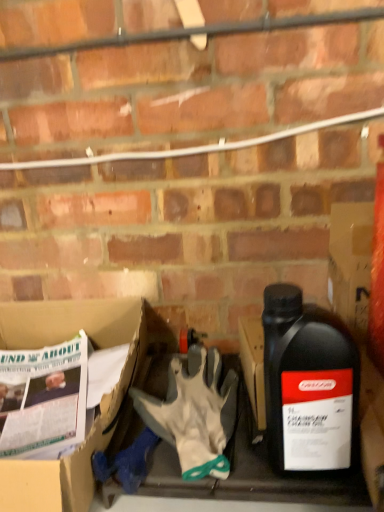
The height and width of the screenshot is (512, 384). I want to click on vacant space to the right of white fabric glove at center, so click(x=246, y=429).